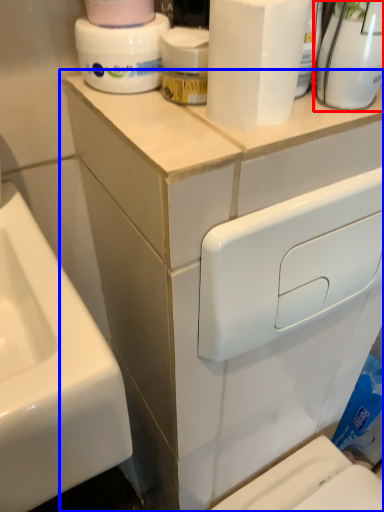
Question: Which of the following is the closest to the observer, cleaning product (highlighted by a red box) or bathroom cabinet (highlighted by a blue box)?

Choices:
 (A) cleaning product
 (B) bathroom cabinet

Answer: (A)